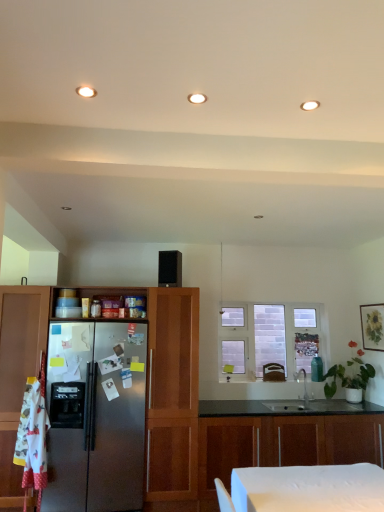
Identify the location of white brick window at center. This screenshot has height=512, width=384. (269, 338).

In order to face satin wood cabinet at left, acting as the first cabinetry starting from the top, should I rotate leftwards or rightwards?

A 0.510 degree turn to the left will do.

Measure the distance between point (213, 422) and camera.

Point (213, 422) and camera are 4.02 meters apart from each other.

Find the location of a particular element. This screenshot has width=384, height=512. wooden cabinets at center, placed as the 1th cabinetry when sorted from bottom to top is located at coordinates (283, 438).

The image size is (384, 512). What are the coordinates of `matte wooden picture frame at upper right` in the screenshot? It's located at (372, 326).

Can satin nickel faucet at center be found inside wooden cabinets at center, which is the second cabinetry from top to bottom?

Actually, satin nickel faucet at center is outside wooden cabinets at center, which is the second cabinetry from top to bottom.

Is wooden cabinets at center, placed as the 1th cabinetry when sorted from bottom to top, positioned before satin nickel faucet at center?

Yes.

Which is more to the right, wooden cabinets at center, placed as the 1th cabinetry when sorted from bottom to top, or satin nickel faucet at center?

satin nickel faucet at center is more to the right.

Starting from the satin nickel faucet at center, which cabinetry is the 1st one in front? Please provide its 2D coordinates.

[(283, 438)]

From a real-world perspective, between brown leather swivel chair at center and white brick window at center, who is vertically lower?

brown leather swivel chair at center is physically lower.

How distant is brown leather swivel chair at center from white brick window at center?

16.65 inches.

Is brown leather swivel chair at center further to the viewer compared to white brick window at center?

No, it is not.

This screenshot has width=384, height=512. Find the location of `window that is above the brown leather swivel chair at center (from the image's perspective)`. window that is above the brown leather swivel chair at center (from the image's perspective) is located at coordinates [x=269, y=338].

Are white brick window at center and black matte speaker at center making contact?

No, white brick window at center is not with black matte speaker at center.

Looking at the image, does white brick window at center seem bigger or smaller compared to black matte speaker at center?

In the image, white brick window at center appears to be larger than black matte speaker at center.

Is white brick window at center spatially inside black matte speaker at center, or outside of it?

white brick window at center cannot be found inside black matte speaker at center.

From a real-world perspective, is white brick window at center physically above black matte speaker at center?

No, from a real-world perspective, white brick window at center is not over black matte speaker at center

Considering the relative sizes of wooden cabinets at center, which is the second cabinetry from top to bottom, and matte wooden picture frame at upper right in the image provided, is wooden cabinets at center, which is the second cabinetry from top to bottom, wider than matte wooden picture frame at upper right?

Indeed, wooden cabinets at center, which is the second cabinetry from top to bottom, has a greater width compared to matte wooden picture frame at upper right.

Between wooden cabinets at center, which is the second cabinetry from top to bottom, and matte wooden picture frame at upper right, which one has more height?

wooden cabinets at center, which is the second cabinetry from top to bottom, is taller.

Can you confirm if wooden cabinets at center, which is the second cabinetry from top to bottom, is bigger than matte wooden picture frame at upper right?

Correct, wooden cabinets at center, which is the second cabinetry from top to bottom, is larger in size than matte wooden picture frame at upper right.

Does black matte speaker at center lie behind white brick window at center?

No, black matte speaker at center is in front of white brick window at center.

Where is `window below the black matte speaker at center (from the image's perspective)`? The width and height of the screenshot is (384, 512). window below the black matte speaker at center (from the image's perspective) is located at coordinates (269, 338).

Is black matte speaker at center oriented away from white brick window at center?

No, black matte speaker at center is not facing the opposite direction of white brick window at center.

From a real-world perspective, which is physically below, black matte speaker at center or white brick window at center?

white brick window at center is physically lower.

From a real-world perspective, between black matte speaker at center and satin nickel faucet at center, who is vertically higher?

black matte speaker at center.

How many degrees apart are the facing directions of black matte speaker at center and satin nickel faucet at center?

black matte speaker at center and satin nickel faucet at center are facing 19.8 degrees away from each other.

Consider the image. Is black matte speaker at center positioned far away from satin nickel faucet at center?

Absolutely, black matte speaker at center is distant from satin nickel faucet at center.

Between black matte speaker at center and satin nickel faucet at center, which one appears on the right side from the viewer's perspective?

satin nickel faucet at center.

Is white brick window at center placed right next to matte wooden picture frame at upper right?

white brick window at center and matte wooden picture frame at upper right are not in contact.

Is white brick window at center to the left or to the right of matte wooden picture frame at upper right in the image?

Clearly, white brick window at center is on the left of matte wooden picture frame at upper right in the image.

Considering the points (232, 316) and (381, 348), which point is behind, point (232, 316) or point (381, 348)?

The point (232, 316) is behind.

Locate an element on the screen. This screenshot has width=384, height=512. picture frame that is above the white brick window at center (from the image's perspective) is located at coordinates (372, 326).

Where is `tap that appears on the right of wooden cabinets at center, placed as the 1th cabinetry when sorted from bottom to top`? This screenshot has height=512, width=384. tap that appears on the right of wooden cabinets at center, placed as the 1th cabinetry when sorted from bottom to top is located at coordinates (303, 383).

Locate an element on the screen. The height and width of the screenshot is (512, 384). swivel chair on the left of white brick window at center is located at coordinates (273, 372).

Based on their spatial positions, is satin wood cabinet at left, the second cabinetry positioned from the bottom, or white brick window at center closer to matte wooden picture frame at upper right?

white brick window at center.

Based on their spatial positions, is matte wooden picture frame at upper right or satin nickel faucet at center further from wooden cabinets at center, which is the second cabinetry from top to bottom?

matte wooden picture frame at upper right.

Based on their spatial positions, is matte wooden picture frame at upper right or satin wood cabinet at left, acting as the first cabinetry starting from the top, further from white brick window at center?

The object further to white brick window at center is satin wood cabinet at left, acting as the first cabinetry starting from the top.

From the image, which object appears to be farther from satin nickel faucet at center, matte wooden picture frame at upper right or brown leather swivel chair at center?

Based on the image, matte wooden picture frame at upper right appears to be further to satin nickel faucet at center.

Estimate the real-world distances between objects in this image. Which object is further from brown leather swivel chair at center, black matte speaker at center or white brick window at center?

Among the two, black matte speaker at center is located further to brown leather swivel chair at center.

Which object lies nearer to the anchor point satin nickel faucet at center, matte wooden picture frame at upper right or satin wood cabinet at left, the second cabinetry positioned from the bottom?

matte wooden picture frame at upper right lies closer to satin nickel faucet at center than the other object.

Estimate the real-world distances between objects in this image. Which object is further from black matte speaker at center, satin nickel faucet at center or wooden cabinets at center, which is the second cabinetry from top to bottom?

The object further to black matte speaker at center is satin nickel faucet at center.

Based on their spatial positions, is wooden cabinets at center, placed as the 1th cabinetry when sorted from bottom to top, or black matte speaker at center closer to matte wooden picture frame at upper right?

wooden cabinets at center, placed as the 1th cabinetry when sorted from bottom to top, is closer to matte wooden picture frame at upper right.

Where is `cabinetry between black matte speaker at center and wooden cabinets at center, placed as the 1th cabinetry when sorted from bottom to top, from top to bottom`? This screenshot has width=384, height=512. cabinetry between black matte speaker at center and wooden cabinets at center, placed as the 1th cabinetry when sorted from bottom to top, from top to bottom is located at coordinates (220, 420).

Where is `tap between wooden cabinets at center, placed as the 1th cabinetry when sorted from bottom to top, and white brick window at center, along the z-axis`? The image size is (384, 512). tap between wooden cabinets at center, placed as the 1th cabinetry when sorted from bottom to top, and white brick window at center, along the z-axis is located at coordinates (303, 383).

Locate an element on the screen. This screenshot has width=384, height=512. swivel chair between satin wood cabinet at left, the second cabinetry positioned from the bottom, and matte wooden picture frame at upper right, in the horizontal direction is located at coordinates (273, 372).

Find the location of a particular element. The height and width of the screenshot is (512, 384). tap situated between satin wood cabinet at left, acting as the first cabinetry starting from the top, and matte wooden picture frame at upper right from left to right is located at coordinates (303, 383).